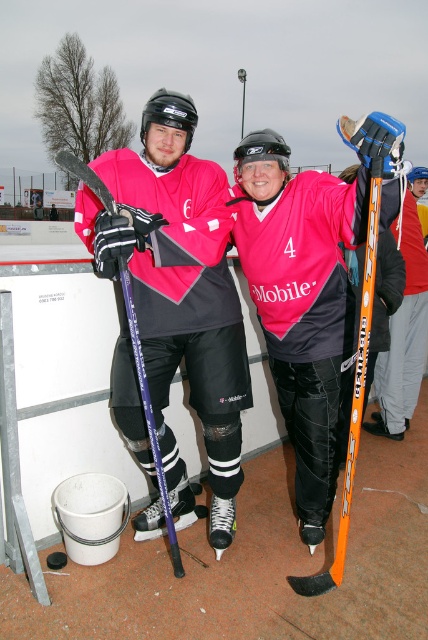
Question: Estimate the real-world distances between objects in this image. Which object is farther from the pink matte hockey jersey at center?

Choices:
 (A) orange metallic hockey stick at center
 (B) purple glossy hockey stick at left

Answer: (A)

Question: Considering the relative positions of orange metallic hockey stick at center and purple glossy hockey stick at left in the image provided, where is orange metallic hockey stick at center located with respect to purple glossy hockey stick at left?

Choices:
 (A) left
 (B) right

Answer: (B)

Question: In this image, where is pink matte hockey jersey at center located relative to purple glossy hockey stick at left?

Choices:
 (A) right
 (B) left

Answer: (A)

Question: Can you confirm if orange metallic hockey stick at center is positioned above purple glossy hockey stick at left?

Choices:
 (A) no
 (B) yes

Answer: (B)

Question: Which of the following is the closest to the observer?

Choices:
 (A) (383, 419)
 (B) (80, 177)
 (C) (314, 438)

Answer: (B)

Question: Estimate the real-world distances between objects in this image. Which object is closer to the pink matte hockey jersey at center?

Choices:
 (A) orange metallic hockey stick at center
 (B) purple glossy hockey stick at left

Answer: (B)